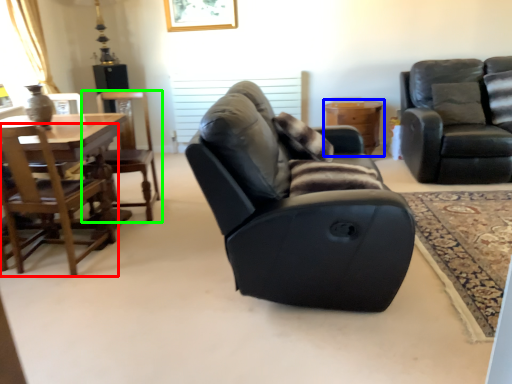
Question: Based on their relative distances, which object is nearer to chair (highlighted by a red box)? Choose from table (highlighted by a blue box) and chair (highlighted by a green box).

Choices:
 (A) table
 (B) chair

Answer: (B)